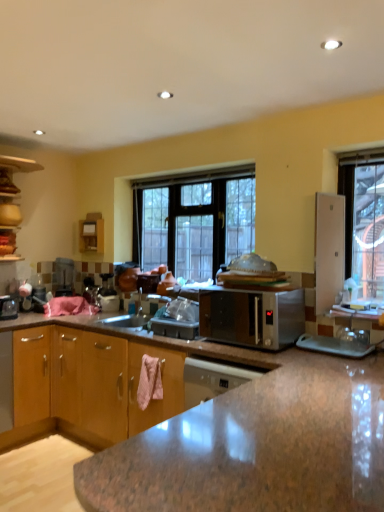
At what (x,y) coordinates should I click in order to perform the action: click on satin silver microwave at center. Please return your answer as a coordinate pair (x, y). Image resolution: width=384 pixels, height=512 pixels. Looking at the image, I should click on (252, 317).

The image size is (384, 512). Describe the element at coordinates (11, 203) in the screenshot. I see `wooden cabinet at left, arranged as the 1th cabinetry when viewed from the left` at that location.

Where is `clear glass window at center`? The width and height of the screenshot is (384, 512). clear glass window at center is located at coordinates (194, 220).

From a real-world perspective, is brown wood cabinet at lower left, placed as the 1th cabinetry when sorted from front to back, located beneath wooden cabinet at left, marked as the 2th cabinetry in a bottom-to-top arrangement?

Correct, in the physical world, brown wood cabinet at lower left, placed as the 1th cabinetry when sorted from front to back, is lower than wooden cabinet at left, marked as the 2th cabinetry in a bottom-to-top arrangement.

Is brown wood cabinet at lower left, placed as the 1th cabinetry when sorted from front to back, completely or partially outside of wooden cabinet at left, acting as the second cabinetry starting from the right?

Yes.

Which object is further away from the camera, brown wood cabinet at lower left, placed as the 1th cabinetry when sorted from right to left, or wooden cabinet at left, which appears as the second cabinetry when viewed from the front?

Positioned behind is wooden cabinet at left, which appears as the second cabinetry when viewed from the front.

I want to click on window that is above the satin silver microwave at center (from the image's perspective), so click(194, 220).

Which point is more distant from viewer, (136,240) or (301,316)?

Positioned behind is point (136,240).

Consider the image. From their relative heights in the image, would you say clear glass window at center is taller or shorter than satin silver microwave at center?

clear glass window at center is taller than satin silver microwave at center.

Are clear glass window at center and satin silver microwave at center located far from each other?

clear glass window at center is near satin silver microwave at center, not far away.

Between brown wood cabinet at lower left, placed as the 1th cabinetry when sorted from right to left, and clear glass window at center, which one has larger size?

With larger size is brown wood cabinet at lower left, placed as the 1th cabinetry when sorted from right to left.

Can you confirm if brown wood cabinet at lower left, acting as the second cabinetry starting from the top, is positioned to the right of clear glass window at center?

Correct, you'll find brown wood cabinet at lower left, acting as the second cabinetry starting from the top, to the right of clear glass window at center.

Which is in front, point (38, 402) or point (235, 188)?

Positioned in front is point (235, 188).

From a real-world perspective, which is physically above, brown wood cabinet at lower left, which is the 2th cabinetry in left-to-right order, or clear glass window at center?

In real-world perspective, clear glass window at center is above.

Does wooden cabinet at left, the first cabinetry when ordered from top to bottom, have a greater width compared to brown wood cabinet at lower left, which appears as the second cabinetry when viewed from the back?

In fact, wooden cabinet at left, the first cabinetry when ordered from top to bottom, might be narrower than brown wood cabinet at lower left, which appears as the second cabinetry when viewed from the back.

From a real-world perspective, which is physically below, wooden cabinet at left, marked as the 2th cabinetry in a bottom-to-top arrangement, or brown wood cabinet at lower left, which appears as the second cabinetry when viewed from the back?

brown wood cabinet at lower left, which appears as the second cabinetry when viewed from the back, is physically lower.

This screenshot has height=512, width=384. Identify the location of cabinetry above the brown wood cabinet at lower left, acting as the 1th cabinetry starting from the bottom (from a real-world perspective). (11, 203).

Is wooden cabinet at left, acting as the second cabinetry starting from the right, shorter than satin silver microwave at center?

In fact, wooden cabinet at left, acting as the second cabinetry starting from the right, may be taller than satin silver microwave at center.

Considering the sizes of objects wooden cabinet at left, which ranks as the 1th cabinetry in back-to-front order, and satin silver microwave at center in the image provided, who is thinner, wooden cabinet at left, which ranks as the 1th cabinetry in back-to-front order, or satin silver microwave at center?

With smaller width is wooden cabinet at left, which ranks as the 1th cabinetry in back-to-front order.

Can you confirm if wooden cabinet at left, acting as the second cabinetry starting from the right, is positioned to the left of satin silver microwave at center?

Correct, you'll find wooden cabinet at left, acting as the second cabinetry starting from the right, to the left of satin silver microwave at center.

How different are the orientations of wooden cabinet at left, which appears as the second cabinetry when viewed from the front, and satin silver microwave at center in degrees?

The angular difference between wooden cabinet at left, which appears as the second cabinetry when viewed from the front, and satin silver microwave at center is 88.6 degrees.

Considering the sizes of satin silver microwave at center and brown wood cabinet at lower left, which appears as the second cabinetry when viewed from the back, in the image, is satin silver microwave at center taller or shorter than brown wood cabinet at lower left, which appears as the second cabinetry when viewed from the back,?

Considering their sizes, satin silver microwave at center has less height than brown wood cabinet at lower left, which appears as the second cabinetry when viewed from the back.

Can you confirm if satin silver microwave at center is wider than brown wood cabinet at lower left, placed as the 1th cabinetry when sorted from front to back?

In fact, satin silver microwave at center might be narrower than brown wood cabinet at lower left, placed as the 1th cabinetry when sorted from front to back.

Is satin silver microwave at center located outside brown wood cabinet at lower left, placed as the 1th cabinetry when sorted from right to left?

Yes, satin silver microwave at center is not within brown wood cabinet at lower left, placed as the 1th cabinetry when sorted from right to left.

Does satin silver microwave at center have a smaller size compared to brown wood cabinet at lower left, acting as the second cabinetry starting from the top?

Yes.

From the image's perspective, between clear glass window at center and wooden cabinet at left, which appears as the second cabinetry when viewed from the front, which one is located above?

wooden cabinet at left, which appears as the second cabinetry when viewed from the front, appears higher in the image.

Is there a large distance between clear glass window at center and wooden cabinet at left, acting as the second cabinetry starting from the right?

Yes.

In order to click on cabinetry lying on the left of clear glass window at center in this screenshot , I will do `click(11, 203)`.

Which of these two, clear glass window at center or wooden cabinet at left, which ranks as the 1th cabinetry in back-to-front order, stands taller?

clear glass window at center is taller.

The width and height of the screenshot is (384, 512). What are the coordinates of `cabinetry on the right of wooden cabinet at left, the first cabinetry when ordered from top to bottom` in the screenshot? It's located at (205, 424).

In order to click on window lying behind the satin silver microwave at center in this screenshot , I will do click(194, 220).

From the image, which object appears to be farther from clear glass window at center, wooden cabinet at left, arranged as the 1th cabinetry when viewed from the left, or brown wood cabinet at lower left, acting as the second cabinetry starting from the top?

wooden cabinet at left, arranged as the 1th cabinetry when viewed from the left, is positioned further to the anchor clear glass window at center.

Based on their spatial positions, is clear glass window at center or satin silver microwave at center closer to wooden cabinet at left, marked as the 2th cabinetry in a bottom-to-top arrangement?

The object closer to wooden cabinet at left, marked as the 2th cabinetry in a bottom-to-top arrangement, is clear glass window at center.

Considering their positions, is brown wood cabinet at lower left, placed as the 1th cabinetry when sorted from front to back, positioned further to wooden cabinet at left, acting as the second cabinetry starting from the right, than clear glass window at center?

Based on the image, brown wood cabinet at lower left, placed as the 1th cabinetry when sorted from front to back, appears to be further to wooden cabinet at left, acting as the second cabinetry starting from the right.

In the scene shown: When comparing their distances from clear glass window at center, does wooden cabinet at left, acting as the second cabinetry starting from the right, or satin silver microwave at center seem closer?

Based on the image, satin silver microwave at center appears to be nearer to clear glass window at center.

Considering their positions, is wooden cabinet at left, acting as the second cabinetry starting from the right, positioned further to satin silver microwave at center than brown wood cabinet at lower left, acting as the second cabinetry starting from the top?

Based on the image, wooden cabinet at left, acting as the second cabinetry starting from the right, appears to be further to satin silver microwave at center.

When comparing their distances from brown wood cabinet at lower left, acting as the second cabinetry starting from the top, does wooden cabinet at left, which appears as the second cabinetry when viewed from the front, or satin silver microwave at center seem further?

wooden cabinet at left, which appears as the second cabinetry when viewed from the front, is further to brown wood cabinet at lower left, acting as the second cabinetry starting from the top.

Estimate the real-world distances between objects in this image. Which object is further from satin silver microwave at center, brown wood cabinet at lower left, acting as the 1th cabinetry starting from the bottom, or clear glass window at center?

Among the two, clear glass window at center is located further to satin silver microwave at center.

Based on their spatial positions, is satin silver microwave at center or wooden cabinet at left, acting as the second cabinetry starting from the right, closer to brown wood cabinet at lower left, placed as the 1th cabinetry when sorted from front to back?

satin silver microwave at center.

You are a GUI agent. You are given a task and a screenshot of the screen. Output one action in this format:
    pyautogui.click(x=<x>, y=<y>)
    Task: Click on the microwave oven between brown wood cabinet at lower left, which is the 2th cabinetry in left-to-right order, and wooden cabinet at left, which appears as the second cabinetry when viewed from the front, in the front-back direction
    Image resolution: width=384 pixels, height=512 pixels.
    Given the screenshot: What is the action you would take?
    pyautogui.click(x=252, y=317)

The image size is (384, 512). I want to click on microwave oven between brown wood cabinet at lower left, placed as the 1th cabinetry when sorted from right to left, and clear glass window at center in the front-back direction, so click(x=252, y=317).

Locate an element on the screen. window positioned between brown wood cabinet at lower left, which is the 2th cabinetry in left-to-right order, and wooden cabinet at left, the first cabinetry when ordered from top to bottom, from near to far is located at coordinates pos(194,220).

Where is `window situated between wooden cabinet at left, which ranks as the 1th cabinetry in back-to-front order, and satin silver microwave at center from left to right`? window situated between wooden cabinet at left, which ranks as the 1th cabinetry in back-to-front order, and satin silver microwave at center from left to right is located at coordinates (194, 220).